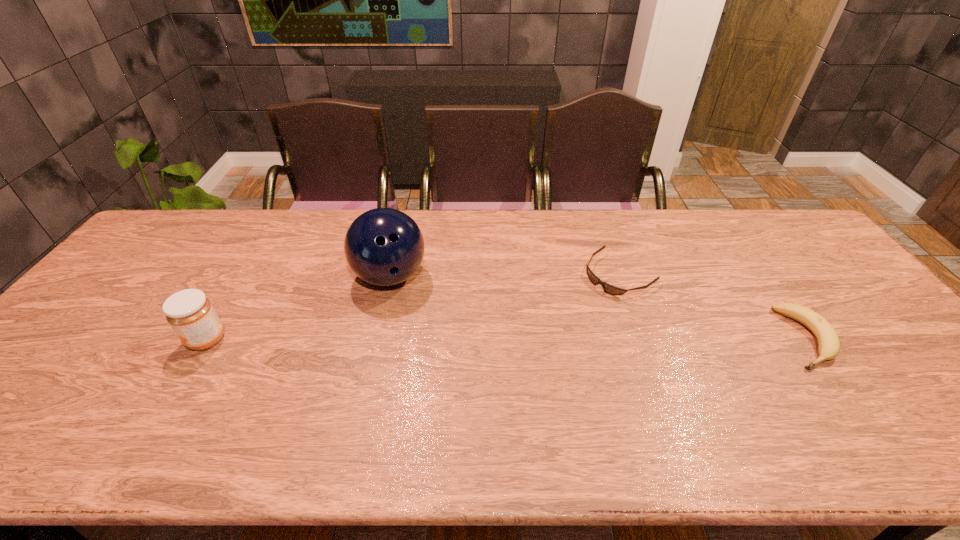
Identify the location of vacant area that lies between the second shortest object and the bowling ball. The image size is (960, 540). (598, 307).

Locate an element on the screen. The width and height of the screenshot is (960, 540). free spot between the tallest object and the third tallest object is located at coordinates (598, 307).

In order to click on free space between the sunglasses and the banana in this screenshot , I will do `click(712, 306)`.

Identify which object is the third nearest to the shortest object. Please provide its 2D coordinates. Your answer should be formatted as a tuple, i.e. [(x, y)], where the tuple contains the x and y coordinates of a point satisfying the conditions above.

[(189, 312)]

Where is `the closest object to the leftmost object`? the closest object to the leftmost object is located at coordinates (383, 246).